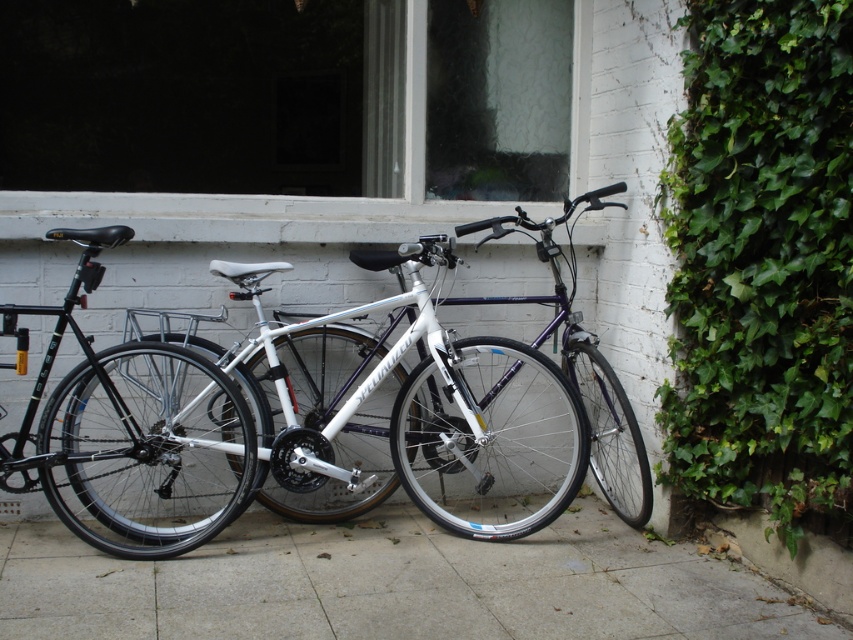
Question: Which object is the closest to the shiny silver bicycle at left?

Choices:
 (A) white matte bicycle at center
 (B) green leafy ivy at right
 (C) gray concrete pavement at center

Answer: (A)

Question: Does white matte bicycle at center appear under shiny silver bicycle at left?

Choices:
 (A) yes
 (B) no

Answer: (A)

Question: Which point is closer to the camera?

Choices:
 (A) (242, 493)
 (B) (813, 196)
 (C) (526, 557)
 (D) (113, 420)

Answer: (B)

Question: Which of the following is the farthest from the observer?

Choices:
 (A) gray concrete pavement at center
 (B) green leafy ivy at right
 (C) white matte bicycle at center

Answer: (C)

Question: Does gray concrete pavement at center have a smaller size compared to white matte bicycle at center?

Choices:
 (A) no
 (B) yes

Answer: (B)

Question: Is green leafy ivy at right smaller than gray concrete pavement at center?

Choices:
 (A) no
 (B) yes

Answer: (A)